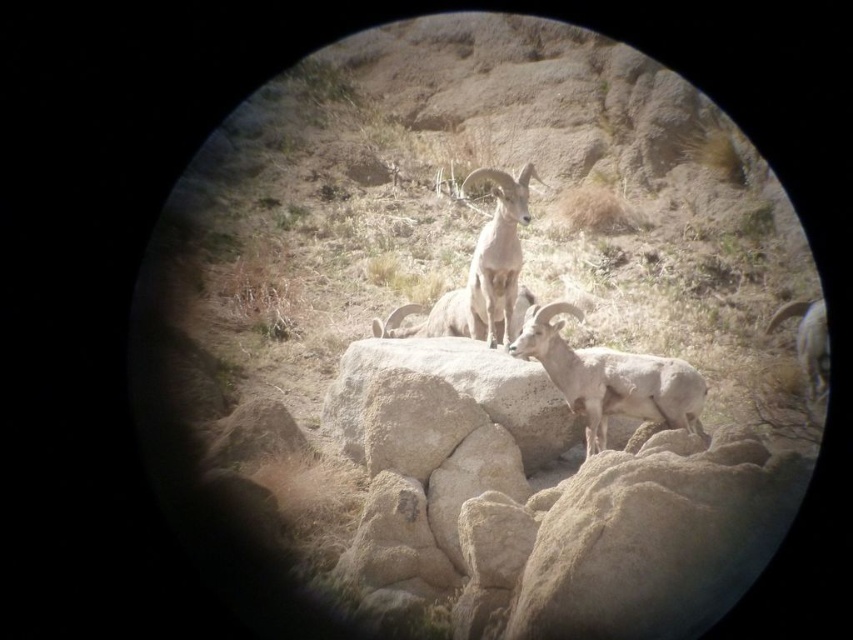
Question: Which of the following is the closest to the observer?

Choices:
 (A) (608, 416)
 (B) (766, 326)

Answer: (A)

Question: Which is nearer to the brown woolen goat at center?

Choices:
 (A) white woolen goat at right
 (B) white woolly sheep at center

Answer: (B)

Question: Which of the following is the farthest from the observer?

Choices:
 (A) brown woolen goat at center
 (B) white woolen goat at right

Answer: (B)

Question: Does white woolly sheep at center have a lesser width compared to white woolen goat at right?

Choices:
 (A) no
 (B) yes

Answer: (A)

Question: Can you confirm if brown woolen goat at center is smaller than white woolen goat at right?

Choices:
 (A) no
 (B) yes

Answer: (B)

Question: Can you confirm if white woolly sheep at center is positioned above white woolen goat at right?

Choices:
 (A) yes
 (B) no

Answer: (B)